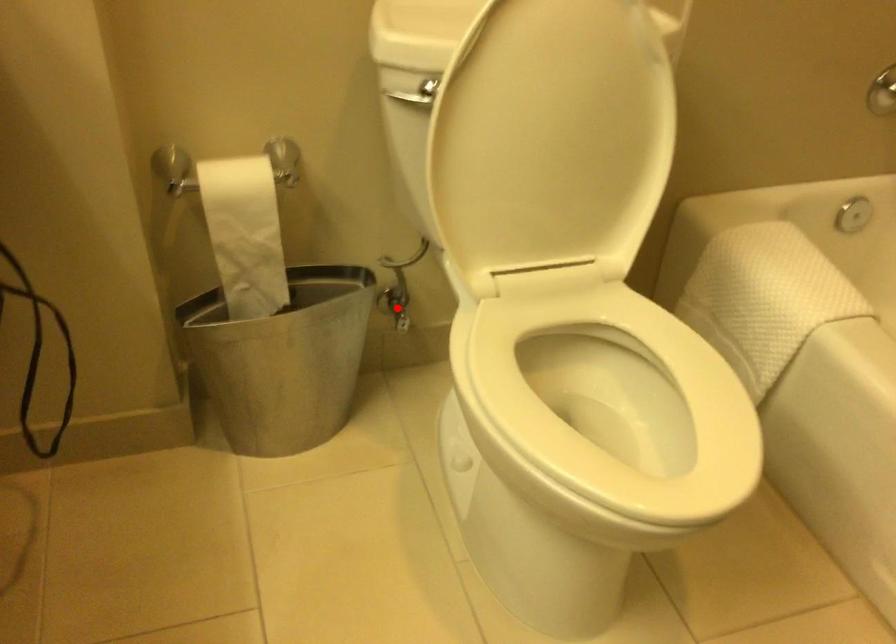
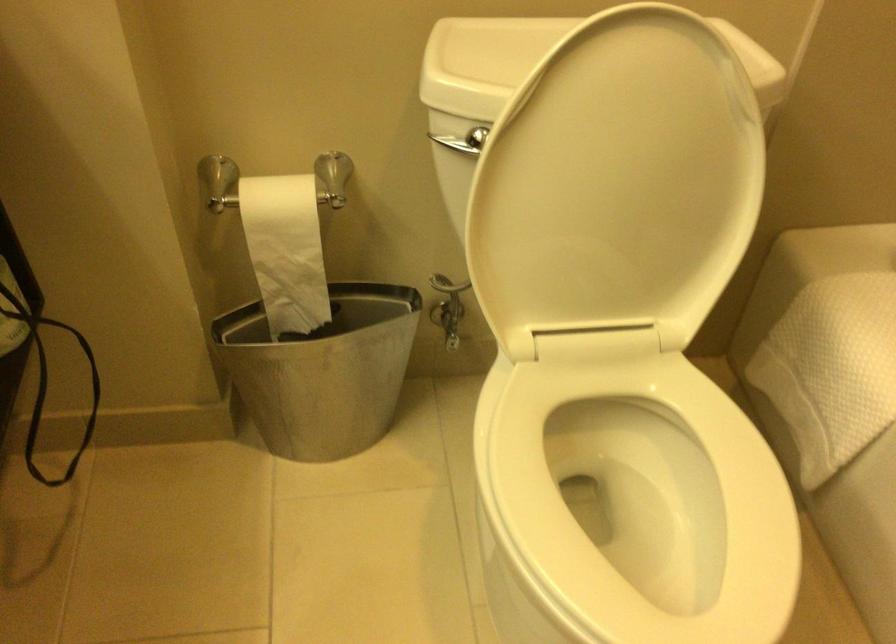
The point at the highlighted location is marked in the first image. Where is the corresponding point in the second image?

(449, 325)